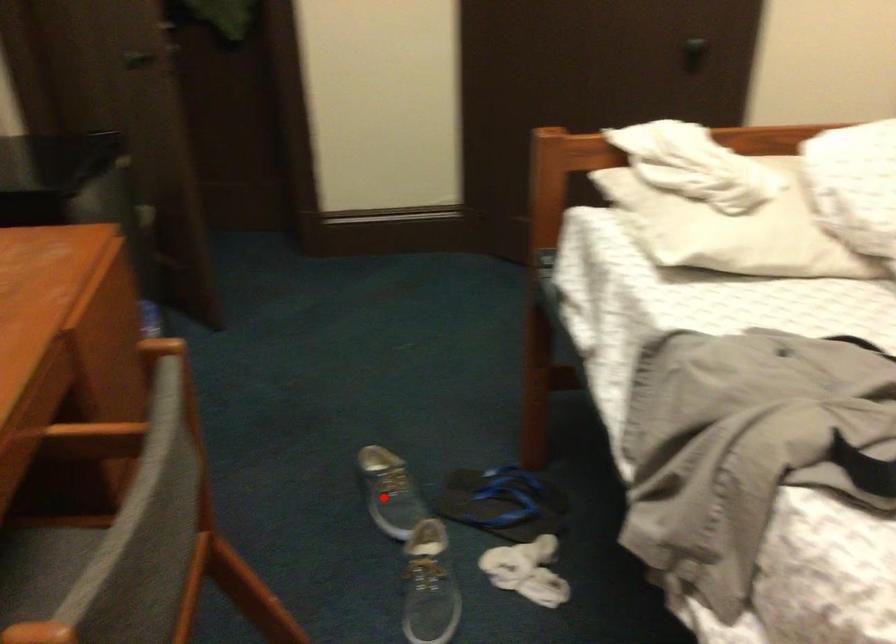
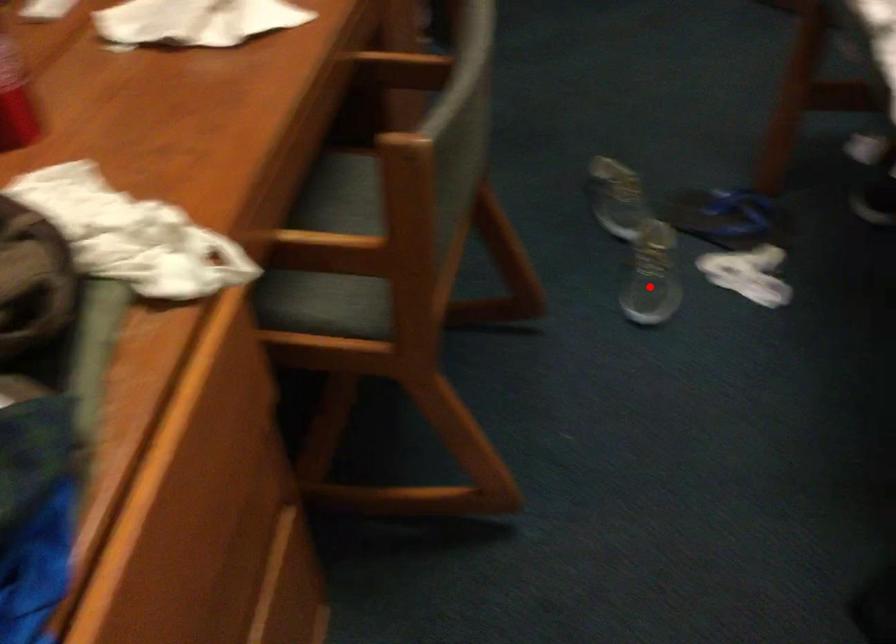
I am providing you with two images of the same scene from different viewpoints. A red point is marked on the first image and another point is marked on the second image. Does the point marked in image1 correspond to the same location as the one in image2?

No